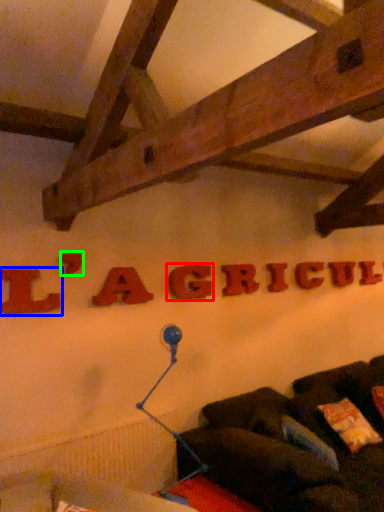
Question: Based on their relative distances, which object is nearer to letter (highlighted by a red box)? Choose from letter (highlighted by a blue box) and letter (highlighted by a green box).

Choices:
 (A) letter
 (B) letter

Answer: (B)